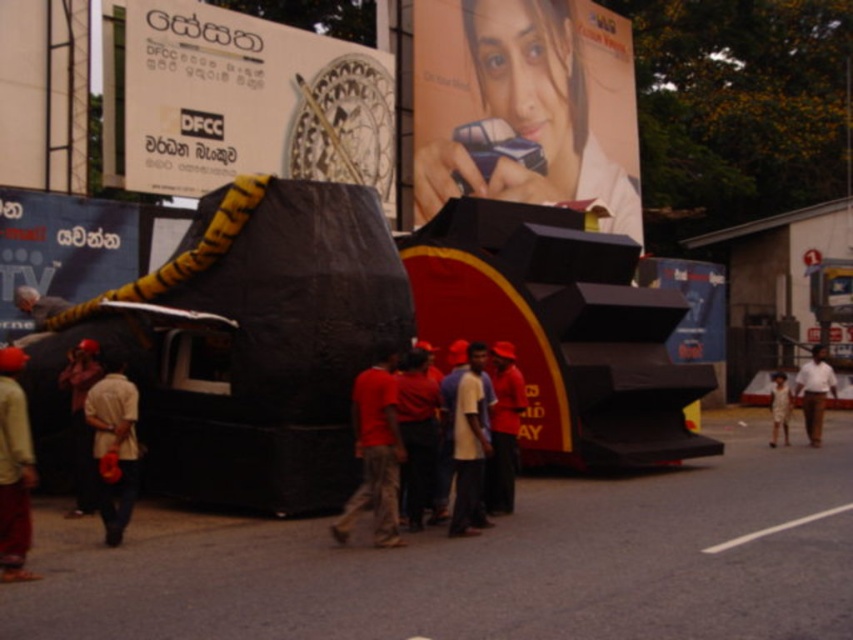
Describe the element at coordinates (531, 104) in the screenshot. The width and height of the screenshot is (853, 640). I see `matte plastic phone at upper center` at that location.

Can you confirm if matte plastic phone at upper center is thinner than white cotton shirt at center?

Incorrect, matte plastic phone at upper center's width is not less than white cotton shirt at center's.

Identify the location of matte plastic phone at upper center. The height and width of the screenshot is (640, 853). (531, 104).

Can you confirm if matte plastic phone at upper center is positioned above dark brown leather jacket at lower left?

Correct, matte plastic phone at upper center is located above dark brown leather jacket at lower left.

Does matte plastic phone at upper center have a lesser height compared to dark brown leather jacket at lower left?

Incorrect, matte plastic phone at upper center's height does not fall short of dark brown leather jacket at lower left's.

Does point (577, 113) come farther from viewer compared to point (93, 339)?

Yes.

This screenshot has width=853, height=640. Find the location of `matte plastic phone at upper center`. matte plastic phone at upper center is located at coordinates (531, 104).

Is white cotton shirt at center below light brown fabric shirt at right?

No.

Find the location of a particular element. white cotton shirt at center is located at coordinates click(x=814, y=392).